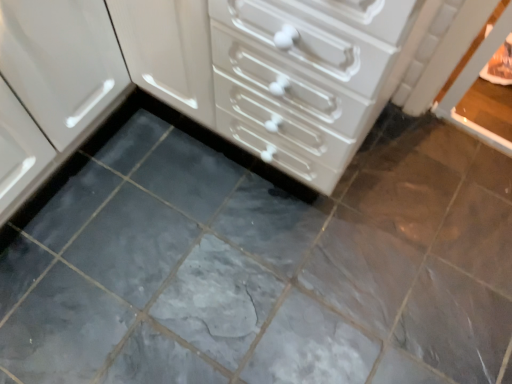
Image resolution: width=512 pixels, height=384 pixels. What do you see at coordinates (273, 71) in the screenshot?
I see `white glossy dresser at center` at bounding box center [273, 71].

Where is `white glossy dresser at center`? white glossy dresser at center is located at coordinates (273, 71).

Where is `white glossy dresser at center`? white glossy dresser at center is located at coordinates (273, 71).